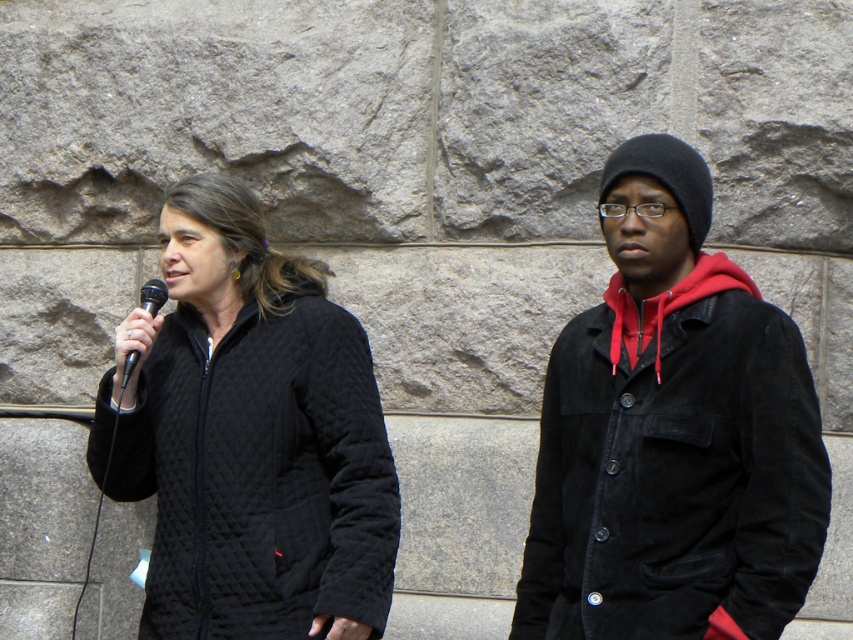
Between quilted black jacket at center and black matte microphone at left, which one appears on the left side from the viewer's perspective?

Positioned to the left is black matte microphone at left.

Who is more forward, (90, 440) or (129, 358)?

Positioned in front is point (129, 358).

Which is in front, point (225, 285) or point (144, 292)?

Positioned in front is point (144, 292).

At what (x,y) coordinates should I click in order to perform the action: click on quilted black jacket at center. Please return your answer as a coordinate pair (x, y). The width and height of the screenshot is (853, 640). Looking at the image, I should click on (250, 436).

Between suede jacket at right and black matte microphone at left, which one is positioned lower?

suede jacket at right is below.

Which of these two, suede jacket at right or black matte microphone at left, stands taller?

suede jacket at right

Which is in front, point (689, 467) or point (138, 291)?

Positioned in front is point (689, 467).

At what (x,y) coordinates should I click in order to perform the action: click on suede jacket at right. Please return your answer as a coordinate pair (x, y). Looking at the image, I should click on pos(672,433).

Can you confirm if suede jacket at right is taller than quilted black jacket at center?

Yes.

Does point (729, 289) lie behind point (279, 426)?

No, (729, 289) is closer to viewer.

Where is `suede jacket at right`? This screenshot has height=640, width=853. suede jacket at right is located at coordinates (672, 433).